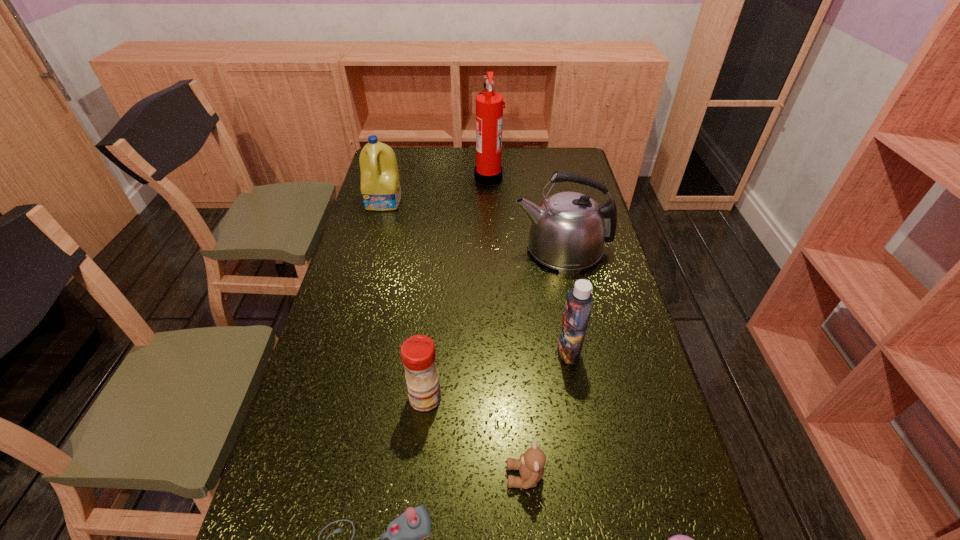
Where is `vacant space located 0.220m on the front-facing side of the sixth tallest object`? The image size is (960, 540). vacant space located 0.220m on the front-facing side of the sixth tallest object is located at coordinates (405, 476).

You are a GUI agent. You are given a task and a screenshot of the screen. Output one action in this format:
    pyautogui.click(x=<x>, y=<y>)
    Task: Click on the vacant position located 0.380m on the front-facing side of the sixth tallest object
    
    Given the screenshot: What is the action you would take?
    pyautogui.click(x=331, y=476)

Find the location of a particular element. object that is at the far edge is located at coordinates (489, 105).

Where is `object at the left edge`? The height and width of the screenshot is (540, 960). object at the left edge is located at coordinates (380, 184).

Find the location of `object that is at the right edge`. object that is at the right edge is located at coordinates (568, 230).

Find the location of a particular element. The width and height of the screenshot is (960, 540). free space at the far edge of the desktop is located at coordinates (526, 175).

Locate an element on the screen. blank space at the left edge of the desktop is located at coordinates (311, 444).

This screenshot has width=960, height=540. In the image, there is a desktop. Find the location of `vacant area at the right edge`. vacant area at the right edge is located at coordinates pyautogui.click(x=663, y=445).

In the image, there is a desktop. Where is `blank space at the far right corner`? The image size is (960, 540). blank space at the far right corner is located at coordinates point(580,174).

The width and height of the screenshot is (960, 540). Identify the location of free space between the fifth nearest object and the fourth shortest object. (497, 374).